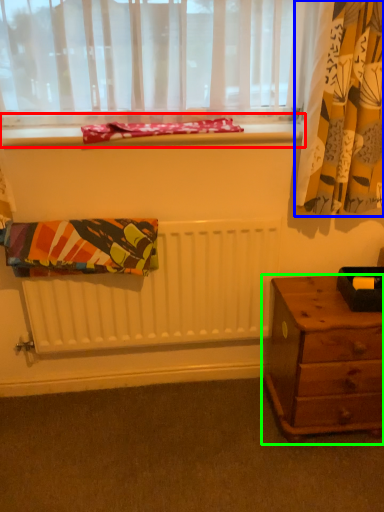
Question: Estimate the real-world distances between objects in this image. Which object is closer to window sill (highlighted by a red box), curtain (highlighted by a blue box) or nightstand (highlighted by a green box)?

Choices:
 (A) curtain
 (B) nightstand

Answer: (A)